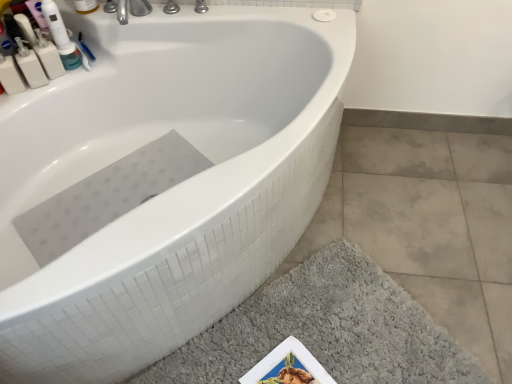
Question: Does white plastic mouthwash at upper left, which appears as the third mouthwash when viewed from the right, have a lesser height compared to white plastic mouthwash at upper left, which is counted as the fourth mouthwash, starting from the right?

Choices:
 (A) no
 (B) yes

Answer: (B)

Question: Can you confirm if white plastic mouthwash at upper left, the 2th mouthwash viewed from the left, is thinner than white plastic mouthwash at upper left, which is counted as the fourth mouthwash, starting from the right?

Choices:
 (A) yes
 (B) no

Answer: (B)

Question: From the image's perspective, does white plastic mouthwash at upper left, which appears as the third mouthwash when viewed from the right, appear higher than white plastic mouthwash at upper left, which is the 1th mouthwash from left to right?

Choices:
 (A) yes
 (B) no

Answer: (A)

Question: Does white plastic mouthwash at upper left, which appears as the third mouthwash when viewed from the right, lie in front of white plastic mouthwash at upper left, which is counted as the fourth mouthwash, starting from the right?

Choices:
 (A) no
 (B) yes

Answer: (A)

Question: Does white plastic mouthwash at upper left, the 2th mouthwash viewed from the left, turn towards white plastic mouthwash at upper left, which is counted as the fourth mouthwash, starting from the right?

Choices:
 (A) yes
 (B) no

Answer: (B)

Question: Is white plastic mouthwash at upper left, the 2th mouthwash viewed from the left, at the right side of white plastic mouthwash at upper left, which is counted as the fourth mouthwash, starting from the right?

Choices:
 (A) yes
 (B) no

Answer: (A)

Question: Is white plastic bottle at upper left, the second mouthwash from the right, touching gray shaggy bath mat at lower right?

Choices:
 (A) yes
 (B) no

Answer: (B)

Question: Considering the relative sizes of white plastic bottle at upper left, the second mouthwash from the right, and gray shaggy bath mat at lower right in the image provided, is white plastic bottle at upper left, the second mouthwash from the right, shorter than gray shaggy bath mat at lower right?

Choices:
 (A) yes
 (B) no

Answer: (B)

Question: Is white plastic bottle at upper left, which ranks as the 3th mouthwash in left-to-right order, oriented towards gray shaggy bath mat at lower right?

Choices:
 (A) no
 (B) yes

Answer: (B)

Question: Considering the relative sizes of white plastic bottle at upper left, the second mouthwash from the right, and gray shaggy bath mat at lower right in the image provided, is white plastic bottle at upper left, the second mouthwash from the right, taller than gray shaggy bath mat at lower right?

Choices:
 (A) no
 (B) yes

Answer: (B)

Question: Is the depth of white plastic bottle at upper left, the second mouthwash from the right, less than that of gray shaggy bath mat at lower right?

Choices:
 (A) yes
 (B) no

Answer: (B)

Question: Is white plastic bottle at upper left, which ranks as the 3th mouthwash in left-to-right order, surrounding gray shaggy bath mat at lower right?

Choices:
 (A) no
 (B) yes

Answer: (A)

Question: Is the surface of white plastic mouthwash at upper left, which is the 1th mouthwash from left to right, in direct contact with gray shaggy bath mat at lower right?

Choices:
 (A) no
 (B) yes

Answer: (A)